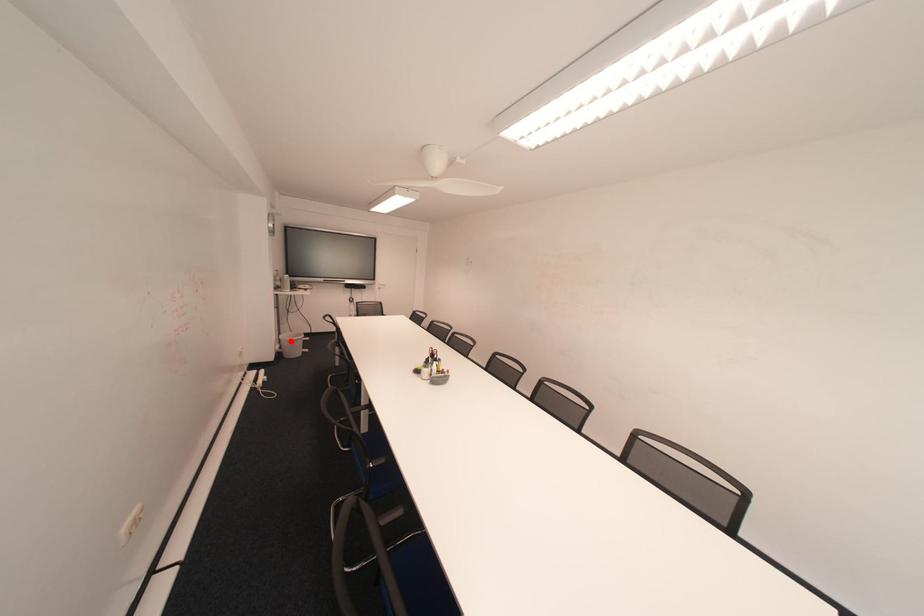
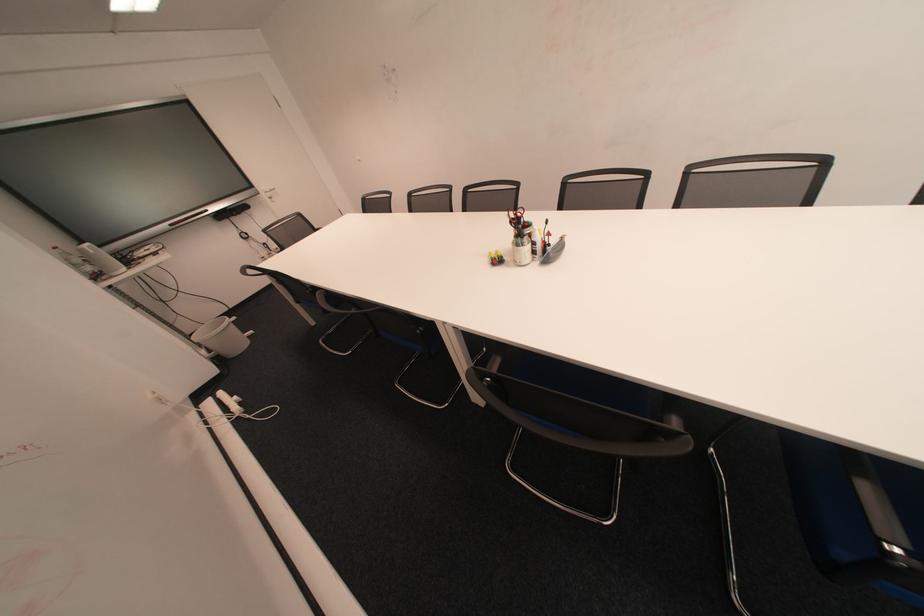
Find the pixel in the second image that matches the highlighted location in the first image.

(209, 345)